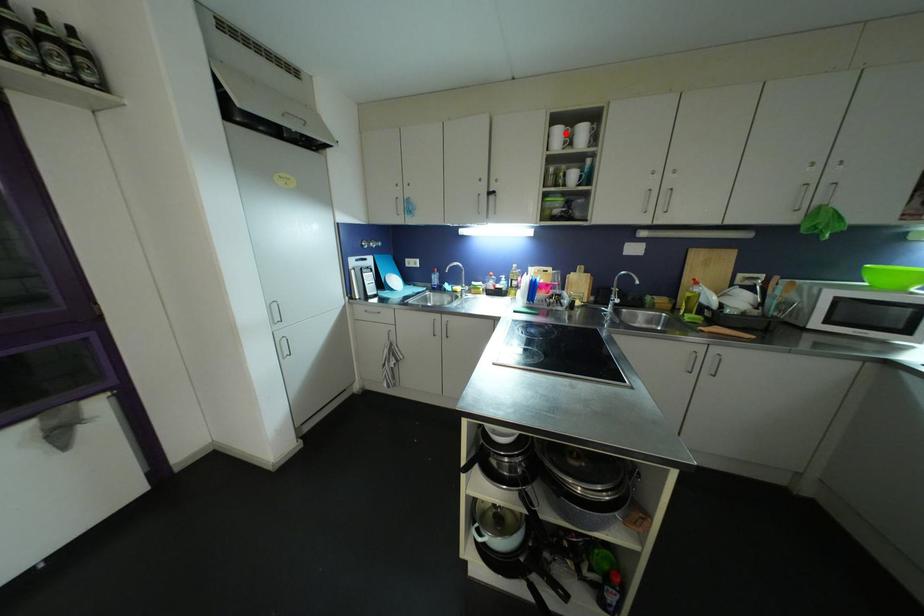
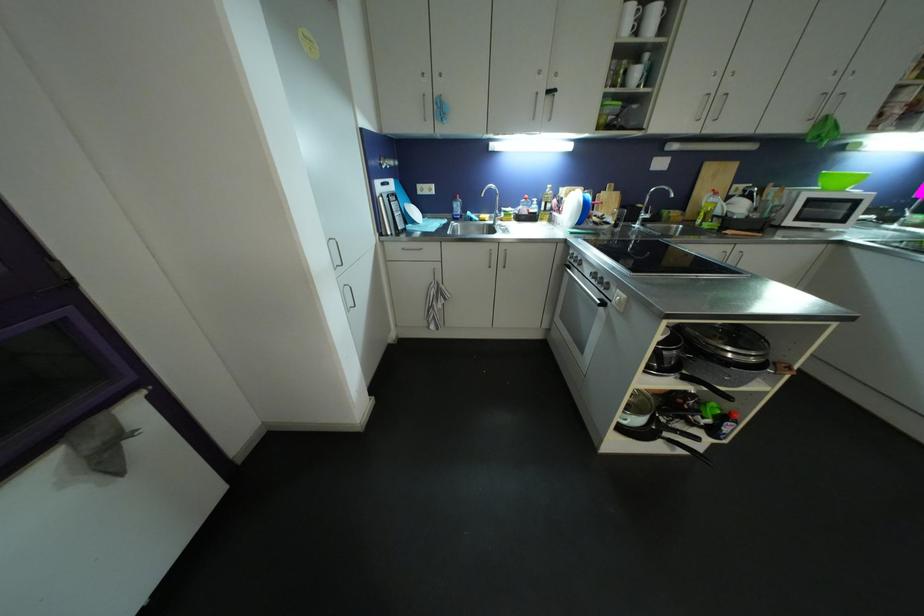
Question: I am providing you with two images of the same scene from different viewpoints. A red point is shown in image1. For the corresponding object point in image2, is it positioned nearer or farther from the camera?

Choices:
 (A) Nearer
 (B) Farther

Answer: (B)